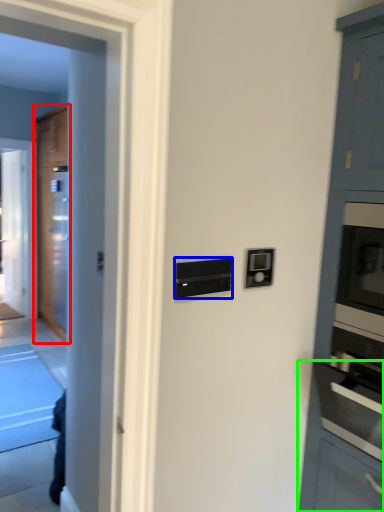
Question: Based on their relative distances, which object is farther from door (highlighted by a red box)? Choose from appliance (highlighted by a blue box) and cabinetry (highlighted by a green box).

Choices:
 (A) appliance
 (B) cabinetry

Answer: (A)